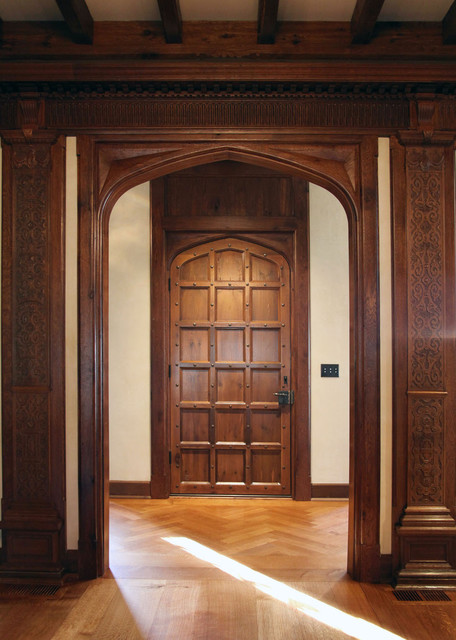
Locate an element on the screen. door is located at coordinates (246, 384).